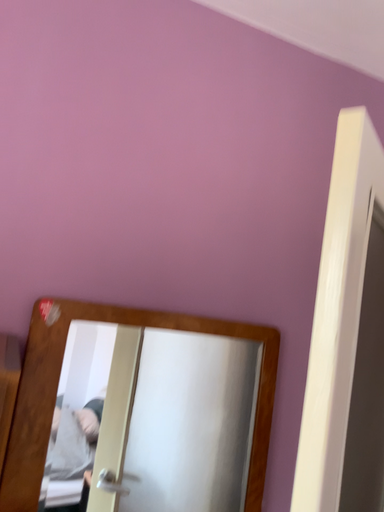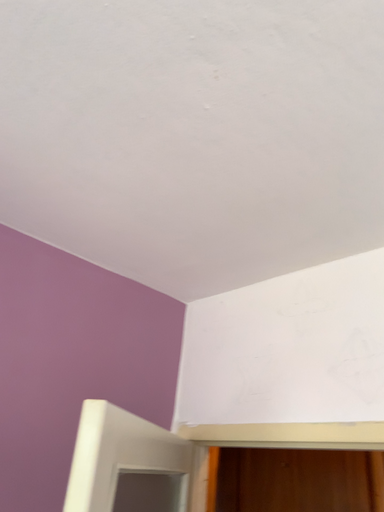
Question: How did the camera likely rotate when shooting the video?

Choices:
 (A) rotated upward
 (B) rotated downward

Answer: (A)